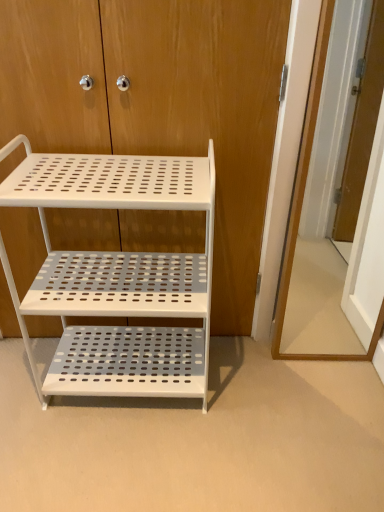
Identify the location of white perforated metal shelf at center. This screenshot has width=384, height=512. (160, 103).

From the image's perspective, is white perforated metal shelf at center under white perforated metal shelf at center?

No, from the image's perspective, white perforated metal shelf at center is not below white perforated metal shelf at center.

Is white perforated metal shelf at center oriented away from white perforated metal shelf at center?

Absolutely, white perforated metal shelf at center is directed away from white perforated metal shelf at center.

Considering the positions of point (21, 35) and point (99, 328), is point (21, 35) closer or farther from the camera than point (99, 328)?

Point (21, 35) is closer to the camera than point (99, 328).

How different are the orientations of white perforated metal shelf at center and white perforated metal shelf at center in degrees?

1.01 degrees.

Are white perforated metal shelf at center and wooden door at right beside each other?

No, white perforated metal shelf at center is not in contact with wooden door at right.

Is white perforated metal shelf at center looking in the opposite direction of wooden door at right?

No, white perforated metal shelf at center's orientation is not away from wooden door at right.

Which object is wider, white perforated metal shelf at center or wooden door at right?

wooden door at right is wider.

In the image, is white perforated metal shelf at center positioned in front of or behind white perforated metal shelf at center?

Visually, white perforated metal shelf at center is located in front of white perforated metal shelf at center.

Which of these two, white perforated metal shelf at center or white perforated metal shelf at center, is thinner?

With smaller width is white perforated metal shelf at center.

From a real-world perspective, between white perforated metal shelf at center and white perforated metal shelf at center, who is vertically lower?

From a 3D spatial view, white perforated metal shelf at center is below.

Is white perforated metal shelf at center smaller than white perforated metal shelf at center?

No.

From a real-world perspective, who is located lower, white perforated metal shelf at center or wooden door at right?

white perforated metal shelf at center is physically lower.

Would you say white perforated metal shelf at center is to the left or to the right of wooden door at right in the picture?

From the image, it's evident that white perforated metal shelf at center is to the left of wooden door at right.

From the image's perspective, between white perforated metal shelf at center and wooden door at right, who is located below?

white perforated metal shelf at center, from the image's perspective.

Is white perforated metal shelf at center thinner than wooden door at right?

Incorrect, the width of white perforated metal shelf at center is not less than that of wooden door at right.

Which of these two, wooden door at right or white perforated metal shelf at center, stands shorter?

white perforated metal shelf at center.

Is wooden door at right thinner than white perforated metal shelf at center?

No, wooden door at right is not thinner than white perforated metal shelf at center.

Is wooden door at right oriented towards white perforated metal shelf at center?

No, wooden door at right is not oriented towards white perforated metal shelf at center.

From the image's perspective, between wooden door at right and white perforated metal shelf at center, who is located below?

wooden door at right, from the image's perspective.

How much distance is there between wooden door at right and white perforated metal shelf at center?

23.85 inches.

From a real-world perspective, does wooden door at right stand above white perforated metal shelf at center?

Yes.

Which of these two, wooden door at right or white perforated metal shelf at center, stands shorter?

Standing shorter between the two is white perforated metal shelf at center.

Is wooden door at right facing towards white perforated metal shelf at center?

No, wooden door at right is not aimed at white perforated metal shelf at center.

Find the location of a particular element. The height and width of the screenshot is (512, 384). dresser behind the white perforated metal shelf at center is located at coordinates (160, 103).

Find the location of a particular element. The width and height of the screenshot is (384, 512). dresser that is above the wooden door at right (from the image's perspective) is located at coordinates (160, 103).

Based on their spatial positions, is white perforated metal shelf at center or white perforated metal shelf at center closer to wooden door at right?

The object closer to wooden door at right is white perforated metal shelf at center.

From the image, which object appears to be nearer to white perforated metal shelf at center, wooden door at right or white perforated metal shelf at center?

Based on the image, white perforated metal shelf at center appears to be nearer to white perforated metal shelf at center.

Looking at the image, which one is located further to wooden door at right, white perforated metal shelf at center or white perforated metal shelf at center?

white perforated metal shelf at center is positioned further to the anchor wooden door at right.

Estimate the real-world distances between objects in this image. Which object is closer to white perforated metal shelf at center, white perforated metal shelf at center or wooden door at right?

white perforated metal shelf at center lies closer to white perforated metal shelf at center than the other object.

Which object lies further to the anchor point white perforated metal shelf at center, white perforated metal shelf at center or wooden door at right?

wooden door at right is further to white perforated metal shelf at center.

Considering their positions, is wooden door at right positioned further to white perforated metal shelf at center than white perforated metal shelf at center?

wooden door at right is positioned further to the anchor white perforated metal shelf at center.

The height and width of the screenshot is (512, 384). I want to click on dresser situated between white perforated metal shelf at center and wooden door at right from left to right, so click(160, 103).